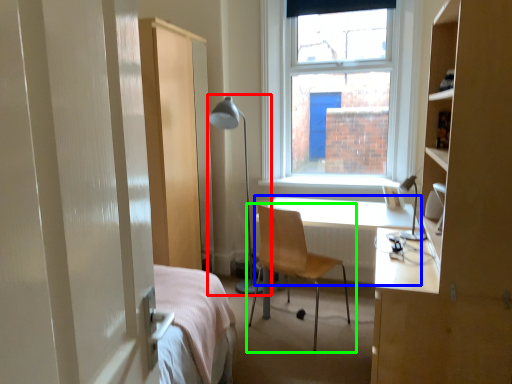
Question: Considering the real-world distances, which object is farthest from table lamp (highlighted by a red box)? desk (highlighted by a blue box) or chair (highlighted by a green box)?

Choices:
 (A) desk
 (B) chair

Answer: (B)